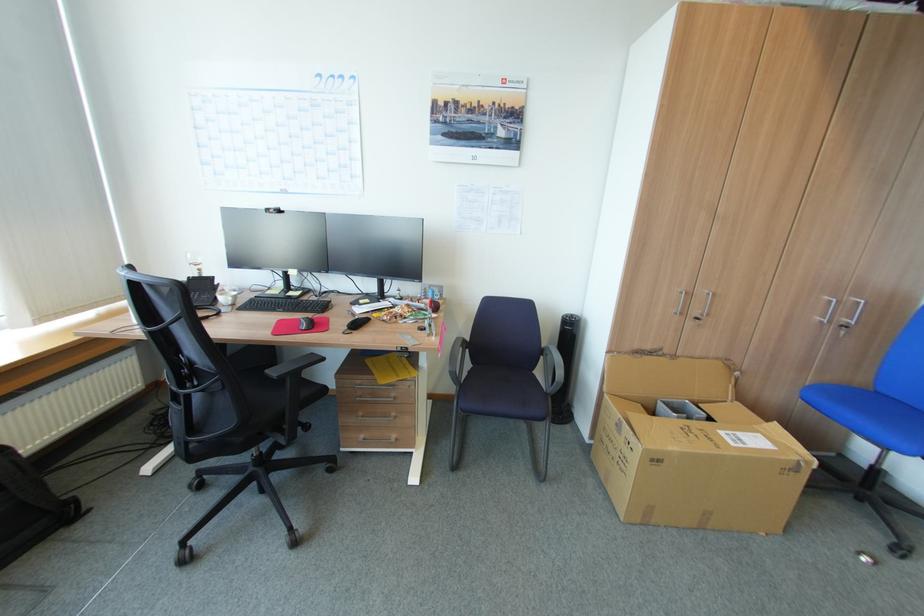
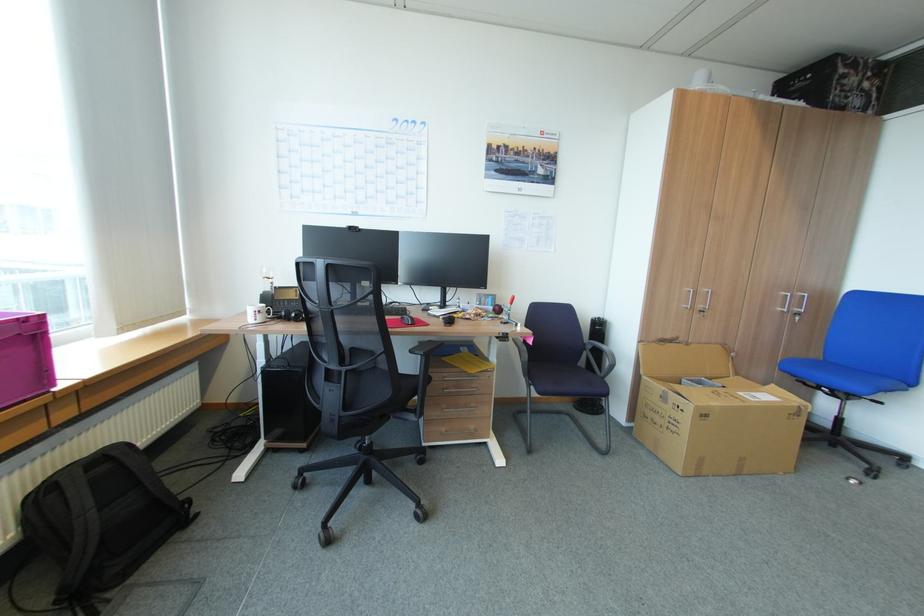
Where in the second image is the point corresponding to (845,326) from the first image?

(800, 314)